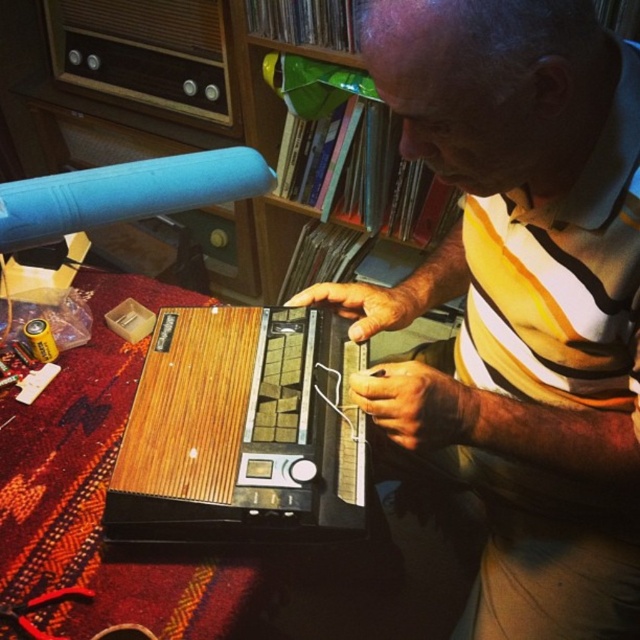
Does yellow striped shirt at center have a larger size compared to wooden bookshelf at upper center?

Actually, yellow striped shirt at center might be smaller than wooden bookshelf at upper center.

Is yellow striped shirt at center positioned at the back of wooden bookshelf at upper center?

No, yellow striped shirt at center is in front of wooden bookshelf at upper center.

Describe the element at coordinates (522, 300) in the screenshot. I see `yellow striped shirt at center` at that location.

Locate an element on the screen. This screenshot has width=640, height=640. yellow striped shirt at center is located at coordinates (522, 300).

Which of these two, yellow striped shirt at center or wooden radio at center, stands shorter?

Standing shorter between the two is wooden radio at center.

Does point (481, 618) come farther from viewer compared to point (292, 429)?

Yes, it is.

I want to click on yellow striped shirt at center, so click(x=522, y=300).

Can you confirm if wooden radio at center is positioned above wooden bookshelf at upper center?

Actually, wooden radio at center is below wooden bookshelf at upper center.

Who is taller, wooden radio at center or wooden bookshelf at upper center?

wooden bookshelf at upper center

Where is `wooden radio at center`? This screenshot has width=640, height=640. wooden radio at center is located at coordinates (241, 429).